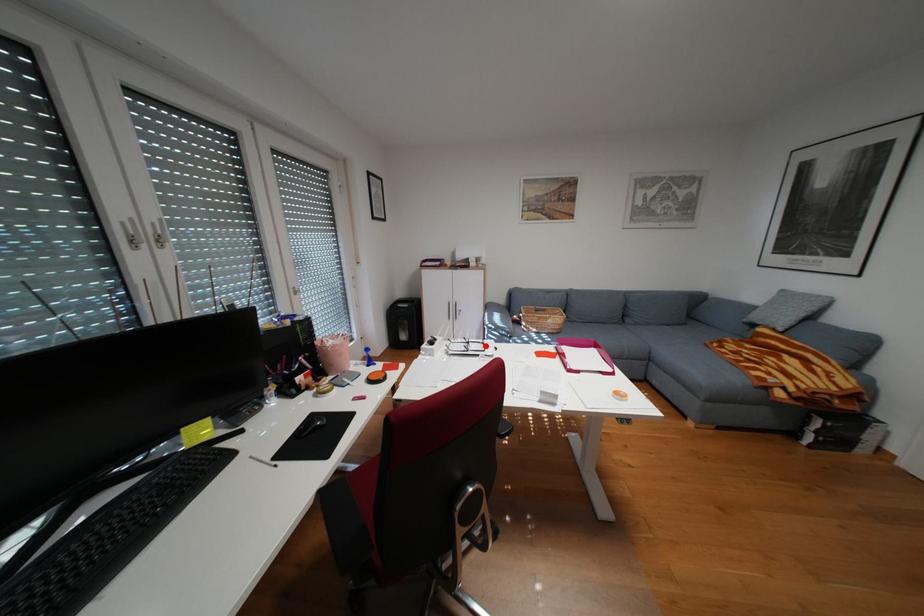
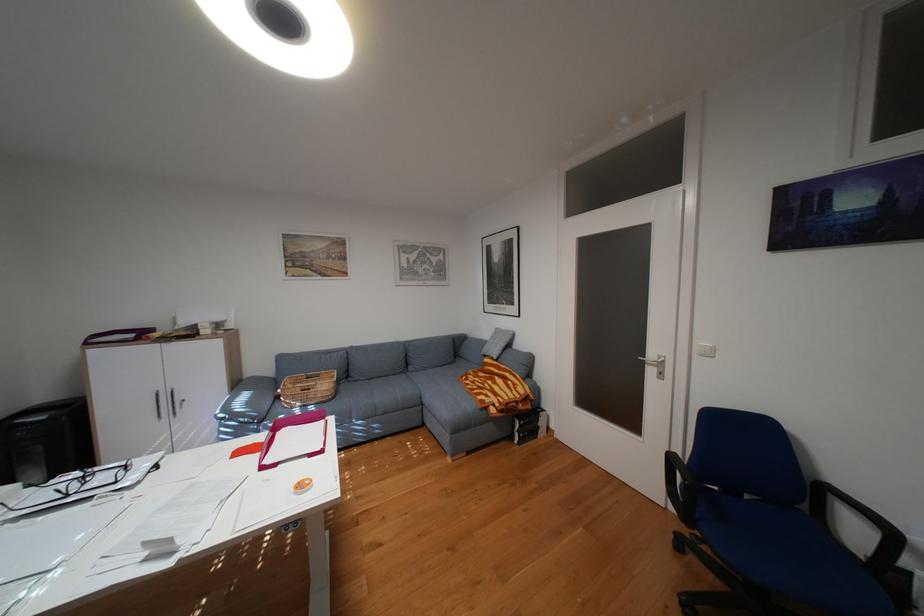
In the second image, find the point that corresponds to the highlighted location in the first image.

(114, 477)